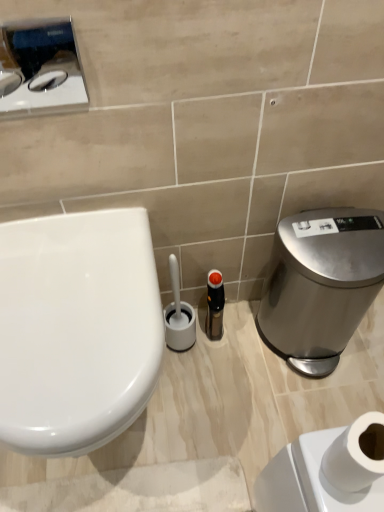
I want to click on vacant area to the right of black plastic bottle at center, so click(253, 337).